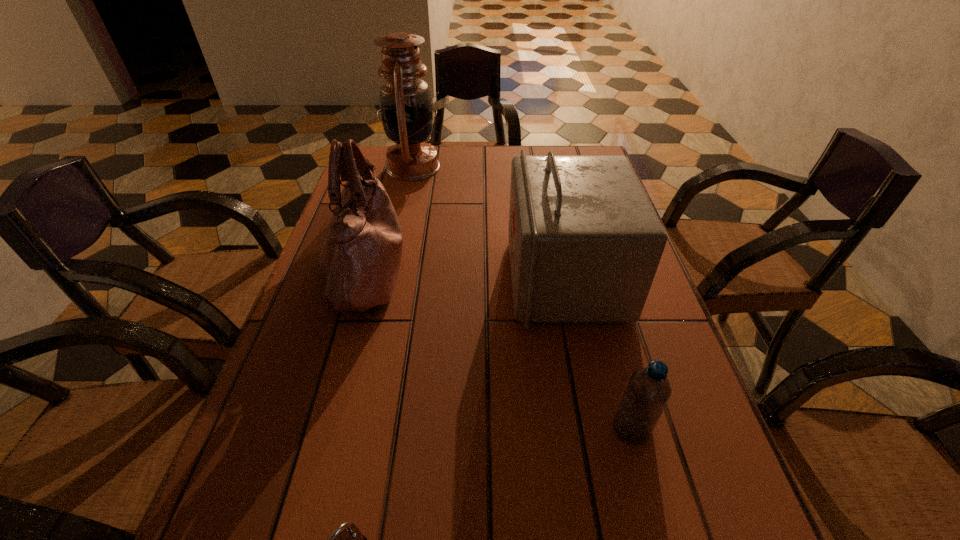
Identify the location of free region at the far left corner of the desktop. (402, 181).

Locate an element on the screen. The height and width of the screenshot is (540, 960). free space between the farthest object and the first-aid kit is located at coordinates (490, 222).

Image resolution: width=960 pixels, height=540 pixels. I want to click on the second closest object to the handbag, so click(585, 242).

Locate which object is the second closest to the handbag. Please provide its 2D coordinates. Your answer should be formatted as a tuple, i.e. [(x, y)], where the tuple contains the x and y coordinates of a point satisfying the conditions above.

[(585, 242)]

This screenshot has width=960, height=540. I want to click on vacant area that satisfies the following two spatial constraints: 1. on the front-facing side of the first-aid kit; 2. on the left side of the fourth farthest object, so click(x=597, y=429).

Find the location of a particular element. This screenshot has width=960, height=540. vacant space that satisfies the following two spatial constraints: 1. on the front side of the tallest object; 2. on the left side of the second nearest object is located at coordinates (355, 429).

The width and height of the screenshot is (960, 540). In order to click on free spot that satisfies the following two spatial constraints: 1. at the front of the handbag with handles; 2. on the right side of the water bottle in this screenshot , I will do `click(323, 429)`.